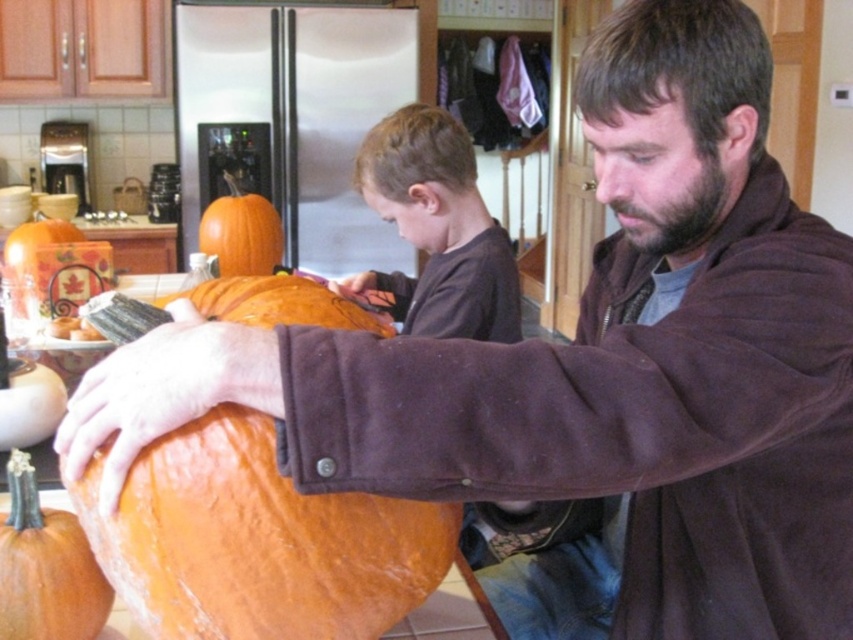
Question: Considering the real-world distances, which object is farthest from the orange matte pumpkin at center?

Choices:
 (A) smooth orange pumpkin at center
 (B) orange matte pumpkin at lower left

Answer: (A)

Question: Which object is closer to the camera taking this photo?

Choices:
 (A) smooth orange pumpkin at center
 (B) orange matte pumpkin at lower left
 (C) orange matte pumpkin at center

Answer: (C)

Question: Is orange matte pumpkin at lower left above orange matte pumpkin at upper center?

Choices:
 (A) yes
 (B) no

Answer: (B)

Question: Does orange matte pumpkin at center appear on the left side of orange matte pumpkin at upper center?

Choices:
 (A) no
 (B) yes

Answer: (A)

Question: Which point is farther to the camera?

Choices:
 (A) orange matte pumpkin at upper center
 (B) orange matte pumpkin at lower left
 (C) orange matte pumpkin at center

Answer: (A)

Question: Is orange matte pumpkin at center closer to the viewer compared to smooth orange pumpkin at center?

Choices:
 (A) yes
 (B) no

Answer: (A)